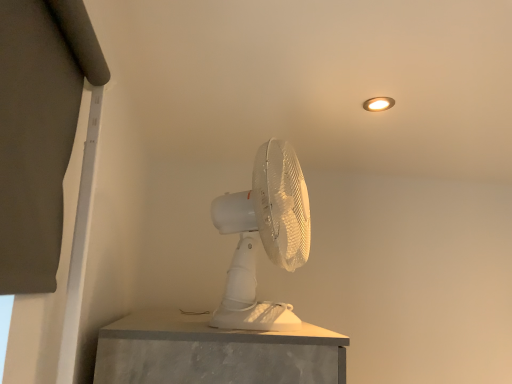
Locate an element on the screen. The image size is (512, 384). free space in front of matte white light fixture at upper right is located at coordinates (393, 75).